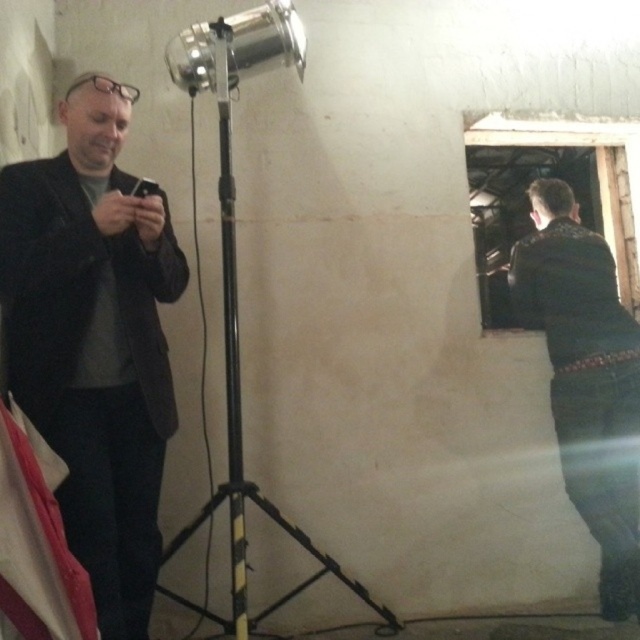
Describe the element at coordinates (93, 340) in the screenshot. I see `black matte suit at left` at that location.

Who is more forward, (36, 420) or (568, 412)?

Positioned in front is point (36, 420).

Is point (1, 308) closer to viewer compared to point (552, 337)?

Yes, point (1, 308) is in front of point (552, 337).

Where is `black matte suit at left`? The width and height of the screenshot is (640, 640). black matte suit at left is located at coordinates (93, 340).

Is black matte suit at left bigger than black matte tripod at center?

Incorrect, black matte suit at left is not larger than black matte tripod at center.

Does black matte suit at left appear under black matte tripod at center?

No.

Measure the distance between black matte suit at left and camera.

They are 1.76 meters apart.

Find the location of a particular element. This screenshot has width=640, height=640. black matte suit at left is located at coordinates (93, 340).

Locate an element on the screen. This screenshot has width=640, height=640. dark green leather jacket at right is located at coordinates (586, 378).

Which is below, dark green leather jacket at right or black matte tripod at center?

Positioned lower is dark green leather jacket at right.

Locate an element on the screen. This screenshot has width=640, height=640. dark green leather jacket at right is located at coordinates (586, 378).